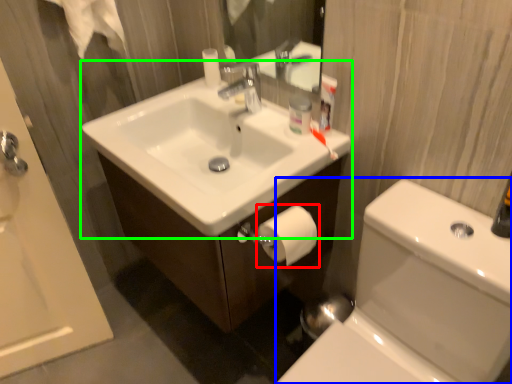
Question: Which is nearer to the toilet paper (highlighted by a red box)? toilet bowl (highlighted by a blue box) or sink (highlighted by a green box).

Choices:
 (A) toilet bowl
 (B) sink

Answer: (B)